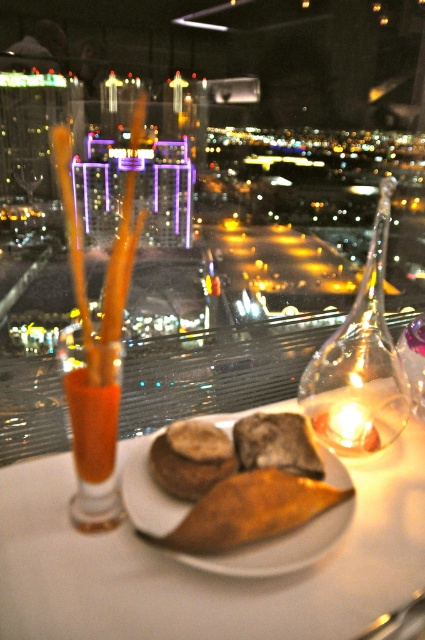
You are a waiter in a high rise restaurant. You need to place a new dessert menu on the table. The menu is 10 cm wide. The table has a rectangular shape. The golden brown crusty bread at center is 15 cm wide. The point at (x=280, y=548) is on the golden brown crusty bread at center. The glass with orange liquid and three straws is on the left side of the plate. The candle is on the right side of the plate. Is there enough space between the golden brown crusty bread at center and the candle to place the 10 cm

The golden brown crusty bread at center is 15 cm wide and the point at (x=280, y=548) is on it. The candle is on the right side of the plate. Since the bread is 15 cm wide and the menu is 10 cm wide, there might be enough space between them if the distance from the right edge of the bread to the candle is at least 10 cm. However, without knowing the exact distance between the bread and the candle, it is uncertain. The description only mentions their positions relative to the plate, not their exact spacing.

You are a waiter at a highrise restaurant. You need to place a new menu between the two points, point (158, 531) and point (85, 472). Which point should you place the menu closer to so it is between them?

You should place the menu closer to point (85, 472) because point (158, 531) is in front of point (85, 472). The menu should be positioned between them by being nearer to the point that is further back.